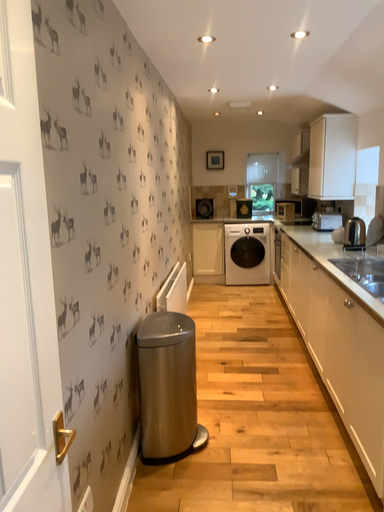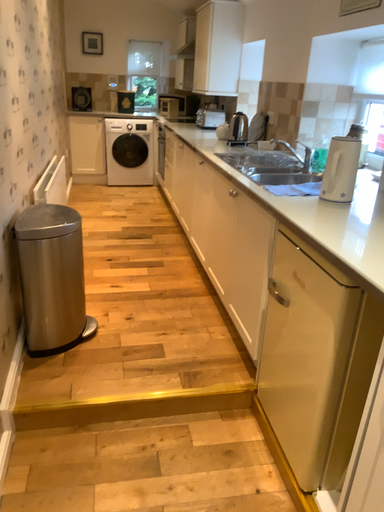
Question: Which way did the camera rotate in the video?

Choices:
 (A) rotated left
 (B) rotated right

Answer: (B)